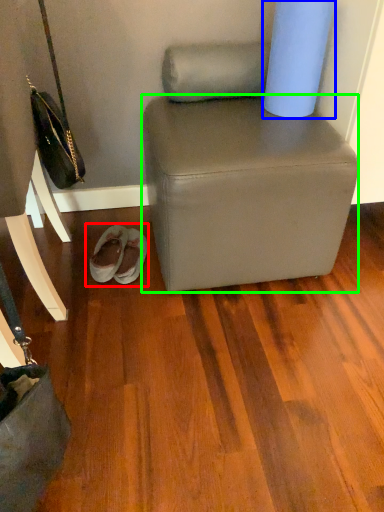
Question: Considering the real-world distances, which object is closest to footwear (highlighted by a red box)? toilet paper (highlighted by a blue box) or stool (highlighted by a green box).

Choices:
 (A) toilet paper
 (B) stool

Answer: (B)